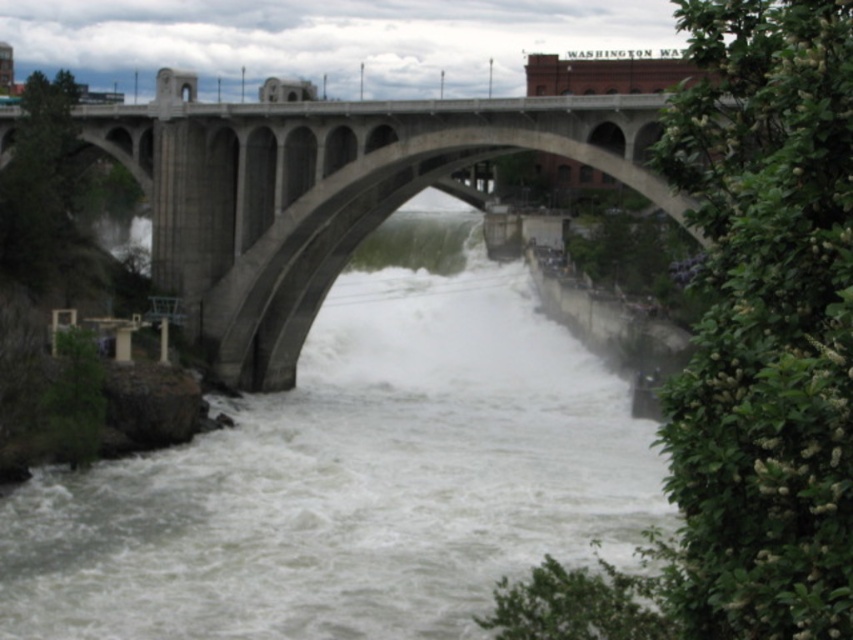
Can you confirm if white frothy water at center is taller than concrete bridge at center?

Yes.

Between point (105, 522) and point (207, 182), which one is positioned in front?

Point (105, 522) is more forward.

Locate an element on the screen. The height and width of the screenshot is (640, 853). white frothy water at center is located at coordinates (354, 470).

The height and width of the screenshot is (640, 853). Identify the location of white frothy water at center. (354, 470).